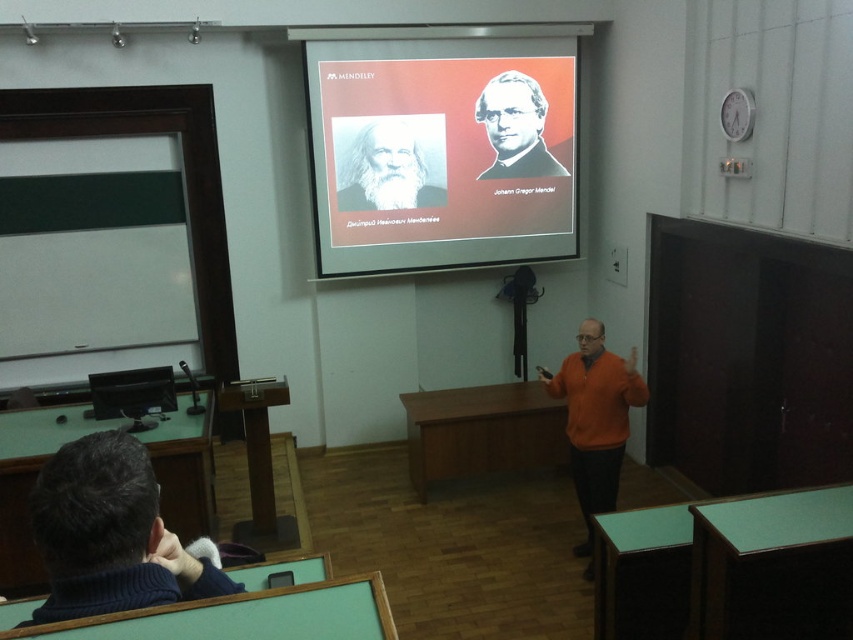
Question: From the image, what is the correct spatial relationship of orange sweater at center in relation to white matte portrait at upper center?

Choices:
 (A) left
 (B) right

Answer: (B)

Question: Does dark blue sweater at lower left appear on the right side of smooth black portrait at upper right?

Choices:
 (A) yes
 (B) no

Answer: (B)

Question: Which of the following is the farthest from the observer?

Choices:
 (A) dark blue sweater at lower left
 (B) smooth black portrait at upper right
 (C) matte plastic projector screen at center
 (D) white matte portrait at upper center

Answer: (B)

Question: Which is farther from the dark blue sweater at lower left?

Choices:
 (A) smooth black portrait at upper right
 (B) white matte portrait at upper center
 (C) orange sweater at center

Answer: (A)

Question: Which object appears farthest from the camera in this image?

Choices:
 (A) orange sweater at center
 (B) smooth black portrait at upper right
 (C) white matte portrait at upper center

Answer: (B)

Question: Is dark blue sweater at lower left positioned in front of orange sweater at center?

Choices:
 (A) no
 (B) yes

Answer: (B)